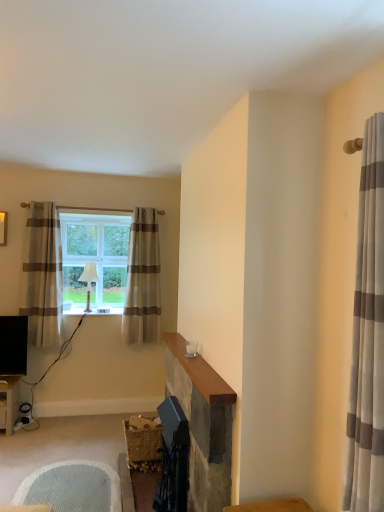
Question: Can you confirm if white fabric lampshade at window is thinner than beige striped curtain at center, the second curtain positioned from the left?

Choices:
 (A) no
 (B) yes

Answer: (A)

Question: Can you confirm if white fabric lampshade at window is positioned to the right of beige striped curtain at center, which ranks as the 3th curtain in front-to-back order?

Choices:
 (A) yes
 (B) no

Answer: (B)

Question: From the image's perspective, is white fabric lampshade at window beneath beige striped curtain at center, which ranks as the first curtain in back-to-front order?

Choices:
 (A) no
 (B) yes

Answer: (B)

Question: Is white fabric lampshade at window oriented away from beige striped curtain at center, the second curtain positioned from the left?

Choices:
 (A) yes
 (B) no

Answer: (B)

Question: Is white fabric lampshade at window outside beige striped curtain at center, the second curtain positioned from the left?

Choices:
 (A) yes
 (B) no

Answer: (A)

Question: Considering the relative positions of white fabric lampshade at window and beige striped curtain at center, which ranks as the first curtain in back-to-front order, in the image provided, is white fabric lampshade at window to the left of beige striped curtain at center, which ranks as the first curtain in back-to-front order, from the viewer's perspective?

Choices:
 (A) yes
 (B) no

Answer: (A)

Question: Does smooth stone fireplace at center have a lesser width compared to white fabric lampshade at window?

Choices:
 (A) yes
 (B) no

Answer: (A)

Question: From a real-world perspective, is smooth stone fireplace at center located higher than white fabric lampshade at window?

Choices:
 (A) no
 (B) yes

Answer: (A)

Question: Considering the relative sizes of smooth stone fireplace at center and white fabric lampshade at window in the image provided, is smooth stone fireplace at center wider than white fabric lampshade at window?

Choices:
 (A) yes
 (B) no

Answer: (B)

Question: From a real-world perspective, is smooth stone fireplace at center under white fabric lampshade at window?

Choices:
 (A) no
 (B) yes

Answer: (B)

Question: Considering the relative positions of smooth stone fireplace at center and white fabric lampshade at window in the image provided, is smooth stone fireplace at center to the left of white fabric lampshade at window from the viewer's perspective?

Choices:
 (A) no
 (B) yes

Answer: (A)

Question: Can you confirm if smooth stone fireplace at center is shorter than white fabric lampshade at window?

Choices:
 (A) no
 (B) yes

Answer: (A)

Question: Is beige striped curtain at center, which ranks as the first curtain in back-to-front order, wider than white fabric lampshade at window?

Choices:
 (A) no
 (B) yes

Answer: (A)